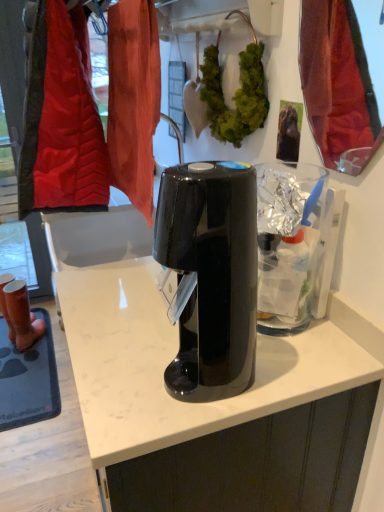
Where is `matte brown boots at left`? The image size is (384, 512). matte brown boots at left is located at coordinates (21, 315).

Find the location of `green leafy plant at center`. green leafy plant at center is located at coordinates (235, 95).

Describe the element at coordinates (235, 95) in the screenshot. I see `green leafy plant at center` at that location.

Locate an element on the screen. This screenshot has height=512, width=384. shiny red fabric at upper right is located at coordinates (338, 85).

Identify the location of mirror above the matte brown boots at left (from the image's perspective). This screenshot has height=512, width=384. (338, 85).

Is matte brown boots at left beside shiny red fabric at upper right?

No, matte brown boots at left is not making contact with shiny red fabric at upper right.

Is matte brown boots at left further to the viewer compared to shiny red fabric at upper right?

Yes.

From a real-world perspective, is matte brown boots at left under shiny red fabric at upper right?

Yes, from a real-world perspective, matte brown boots at left is under shiny red fabric at upper right.

Is matte brown boots at left not near green leafy plant at center?

Yes, matte brown boots at left and green leafy plant at center are quite far apart.

Can you confirm if matte brown boots at left is thinner than green leafy plant at center?

No, matte brown boots at left is not thinner than green leafy plant at center.

From a real-world perspective, which is physically below, shiny red fabric at upper right or green leafy plant at center?

green leafy plant at center.

Considering the positions of points (354, 92) and (239, 55), is point (354, 92) closer to camera compared to point (239, 55)?

No, (354, 92) is behind (239, 55).

How distant is shiny red fabric at upper right from green leafy plant at center?

A distance of 13.14 inches exists between shiny red fabric at upper right and green leafy plant at center.

Does shiny red fabric at upper right have a lesser width compared to green leafy plant at center?

Indeed, shiny red fabric at upper right has a lesser width compared to green leafy plant at center.

From the image's perspective, is shiny red fabric at upper right located above or below black glossy coffee maker at center?

shiny red fabric at upper right is above black glossy coffee maker at center.

From a real-world perspective, is shiny red fabric at upper right below black glossy coffee maker at center?

Incorrect, from a real-world perspective, shiny red fabric at upper right is higher than black glossy coffee maker at center.

In terms of width, does shiny red fabric at upper right look wider or thinner when compared to black glossy coffee maker at center?

Considering their sizes, shiny red fabric at upper right looks slimmer than black glossy coffee maker at center.

Is point (341, 146) behind point (185, 341)?

Yes, point (341, 146) is farther from viewer.

Between point (199, 306) and point (23, 305), which one is positioned behind?

The point (23, 305) is farther.

Is black glossy coffee maker at center wider than matte brown boots at left?

Incorrect, the width of black glossy coffee maker at center does not surpass that of matte brown boots at left.

Is black glossy coffee maker at center looking in the opposite direction of matte brown boots at left?

black glossy coffee maker at center does not have its back to matte brown boots at left.

Considering the sizes of objects green leafy plant at center and shiny red fabric at upper right in the image provided, who is shorter, green leafy plant at center or shiny red fabric at upper right?

Standing shorter between the two is green leafy plant at center.

From the image's perspective, is green leafy plant at center above shiny red fabric at upper right?

Yes.

Is green leafy plant at center to the left or to the right of shiny red fabric at upper right in the image?

In the image, green leafy plant at center appears on the left side of shiny red fabric at upper right.

Can you confirm if green leafy plant at center is smaller than shiny red fabric at upper right?

Indeed, green leafy plant at center has a smaller size compared to shiny red fabric at upper right.

Is shiny red fabric at upper right inside the boundaries of matte brown boots at left, or outside?

The correct answer is: outside.

Is shiny red fabric at upper right behind matte brown boots at left?

That is False.

Would you say shiny red fabric at upper right is to the left or to the right of matte brown boots at left in the picture?

From the image, it's evident that shiny red fabric at upper right is to the right of matte brown boots at left.

In order to click on footwear that appears on the left of shiny red fabric at upper right in this screenshot , I will do `click(21, 315)`.

At what (x,y) coordinates should I click in order to perform the action: click on footwear that is under the green leafy plant at center (from a real-world perspective). Please return your answer as a coordinate pair (x, y). The width and height of the screenshot is (384, 512). Looking at the image, I should click on (21, 315).

Considering their positions, is black glossy coffee maker at center positioned further to matte brown boots at left than shiny red fabric at upper right?

black glossy coffee maker at center is further to matte brown boots at left.

When comparing their distances from black glossy coffee maker at center, does green leafy plant at center or matte brown boots at left seem closer?

green leafy plant at center is positioned closer to the anchor black glossy coffee maker at center.

From the image, which object appears to be nearer to green leafy plant at center, shiny red fabric at upper right or matte brown boots at left?

Among the two, shiny red fabric at upper right is located nearer to green leafy plant at center.

Estimate the real-world distances between objects in this image. Which object is closer to green leafy plant at center, black glossy coffee maker at center or shiny red fabric at upper right?

shiny red fabric at upper right lies closer to green leafy plant at center than the other object.

Which object lies further to the anchor point shiny red fabric at upper right, green leafy plant at center or matte brown boots at left?

Among the two, matte brown boots at left is located further to shiny red fabric at upper right.

When comparing their distances from matte brown boots at left, does green leafy plant at center or shiny red fabric at upper right seem further?

Among the two, shiny red fabric at upper right is located further to matte brown boots at left.

Estimate the real-world distances between objects in this image. Which object is further from shiny red fabric at upper right, matte brown boots at left or black glossy coffee maker at center?

Among the two, matte brown boots at left is located further to shiny red fabric at upper right.

Looking at the image, which one is located further to shiny red fabric at upper right, matte brown boots at left or green leafy plant at center?

matte brown boots at left lies further to shiny red fabric at upper right than the other object.

This screenshot has height=512, width=384. What are the coordinates of `mirror between black glossy coffee maker at center and green leafy plant at center from front to back` in the screenshot? It's located at (338, 85).

Find the location of `mirror between black glossy coffee maker at center and matte brown boots at left in the front-back direction`. mirror between black glossy coffee maker at center and matte brown boots at left in the front-back direction is located at coordinates (338, 85).

Find the location of a particular element. The image size is (384, 512). plant located between shiny red fabric at upper right and matte brown boots at left in the depth direction is located at coordinates (235, 95).

The image size is (384, 512). Identify the location of plant between black glossy coffee maker at center and matte brown boots at left from front to back. (235, 95).